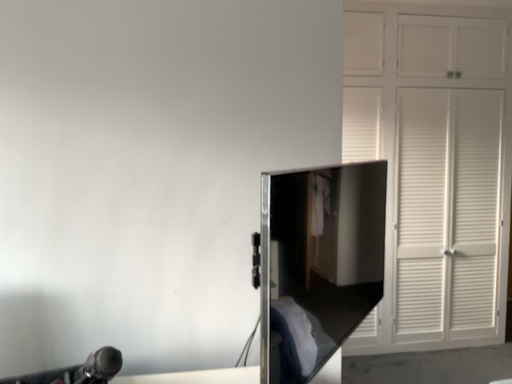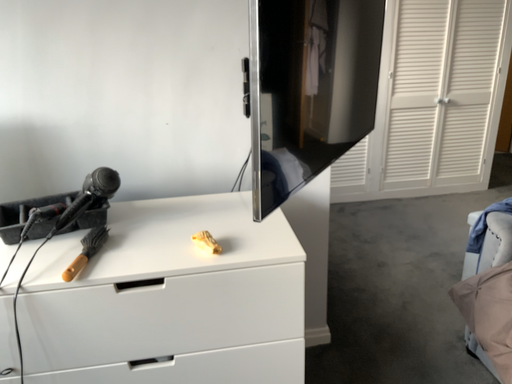
Question: How did the camera likely rotate when shooting the video?

Choices:
 (A) rotated upward
 (B) rotated downward

Answer: (B)